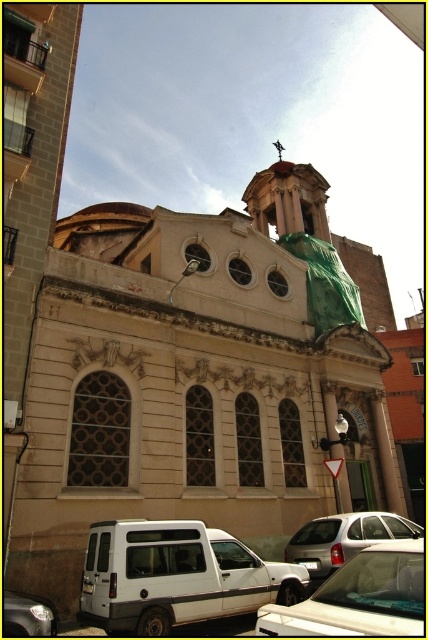
Between white matte van at lower left and shiny silver van at lower left, which one has less height?

Standing shorter between the two is shiny silver van at lower left.

Can you confirm if white matte van at lower left is taller than shiny silver van at lower left?

→ Indeed, white matte van at lower left has a greater height compared to shiny silver van at lower left.

Between point (169, 564) and point (26, 625), which one is positioned in front?

Point (26, 625) is in front.

Identify the location of white matte van at lower left. (175, 577).

Is beige stone church at center wider than shiny silver van at lower left?

Correct, the width of beige stone church at center exceeds that of shiny silver van at lower left.

What do you see at coordinates (201, 376) in the screenshot?
I see `beige stone church at center` at bounding box center [201, 376].

Measure the distance between point [17,488] and camera.

They are 37.03 meters apart.

You are a GUI agent. You are given a task and a screenshot of the screen. Output one action in this format:
    pyautogui.click(x=<x>, y=<y>)
    Task: Click on the beige stone church at center
    
    Given the screenshot: What is the action you would take?
    pyautogui.click(x=201, y=376)

Between point (416, 630) and point (311, 560), which one is positioned in front?

Point (416, 630)

Does white matte car at lower right appear under silver metallic car at center?

Actually, white matte car at lower right is above silver metallic car at center.

I want to click on white matte car at lower right, so click(x=359, y=596).